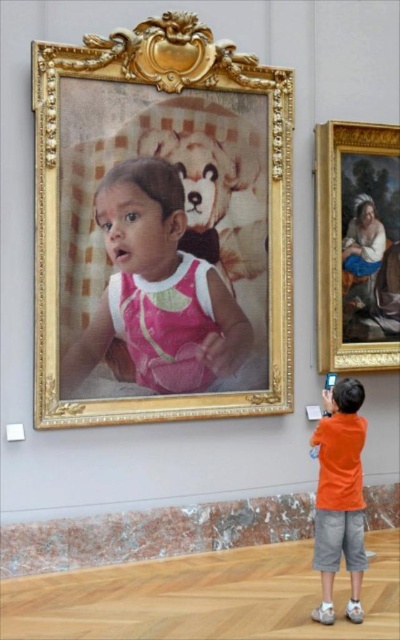
Question: Considering the relative positions of gold ornate frame at upper center and matte pink dress at center in the image provided, where is gold ornate frame at upper center located with respect to matte pink dress at center?

Choices:
 (A) above
 (B) below

Answer: (A)

Question: Observing the image, what is the correct spatial positioning of gold/gilded wood painting at upper right in reference to orange cotton shirt at lower right?

Choices:
 (A) below
 (B) above

Answer: (B)

Question: Can you confirm if gold ornate frame at upper center is bigger than gold/gilded wood painting at upper right?

Choices:
 (A) yes
 (B) no

Answer: (A)

Question: Which object appears closest to the camera in this image?

Choices:
 (A) orange cotton shirt at lower right
 (B) gold/gilded wood painting at upper right

Answer: (A)

Question: Which object is closer to the camera taking this photo?

Choices:
 (A) gold ornate frame at upper center
 (B) matte pink dress at center

Answer: (A)

Question: Estimate the real-world distances between objects in this image. Which object is closer to the gold ornate frame at upper center?

Choices:
 (A) gold/gilded wood painting at upper right
 (B) orange cotton shirt at lower right
 (C) matte pink dress at center

Answer: (C)